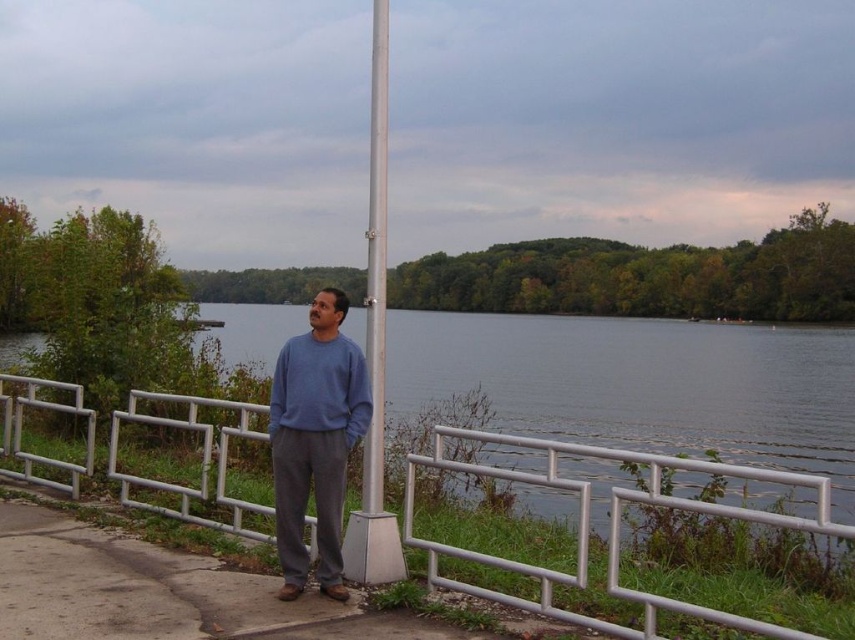
Question: Which point appears farthest from the camera in this image?

Choices:
 (A) (187, 493)
 (B) (286, 403)
 (C) (372, 392)

Answer: (A)

Question: Which of the following is the farthest from the observer?

Choices:
 (A) (690, 609)
 (B) (282, 426)
 (C) (382, 259)

Answer: (C)

Question: Which of the following is the farthest from the observer?

Choices:
 (A) 323,429
 (B) 388,515
 (C) 652,454

Answer: (C)

Question: Can you confirm if silver metallic fence at center is thinner than silver metallic pole at center?

Choices:
 (A) no
 (B) yes

Answer: (B)

Question: Observing the image, what is the correct spatial positioning of silver metallic fence at center in reference to matte blue sweater at center?

Choices:
 (A) below
 (B) above

Answer: (A)

Question: Is silver metallic fence at center to the left of silver metallic pole at center from the viewer's perspective?

Choices:
 (A) yes
 (B) no

Answer: (A)